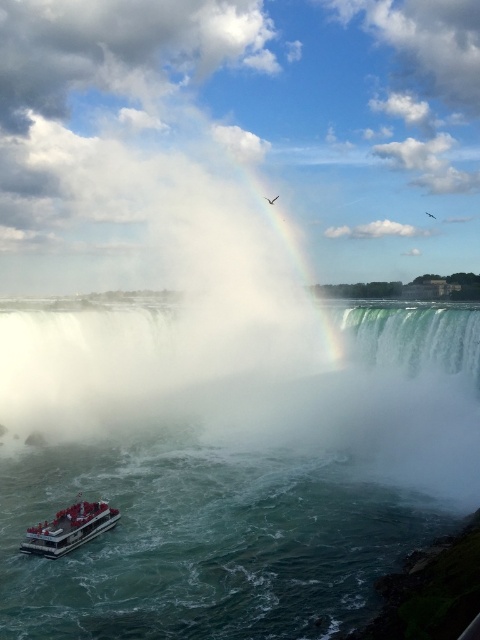
Who is positioned more to the right, clear water at lower left or white plastic boat at lower left?

Positioned to the right is clear water at lower left.

From the picture: Is clear water at lower left closer to the viewer compared to white plastic boat at lower left?

Yes, it is in front of white plastic boat at lower left.

Is point (249, 612) less distant than point (83, 540)?

Yes.

Where is `clear water at lower left`? This screenshot has height=640, width=480. clear water at lower left is located at coordinates (257, 497).